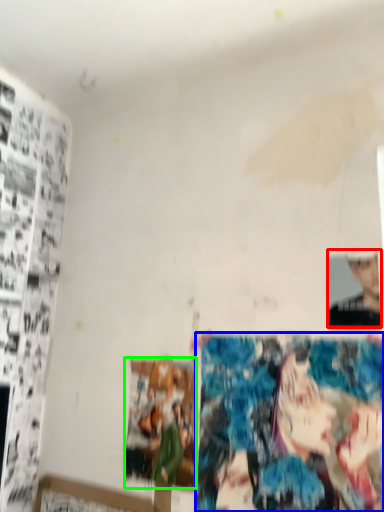
Question: Which is nearer to the person (highlighted by a red box)? reflection (highlighted by a blue box) or print (highlighted by a green box).

Choices:
 (A) reflection
 (B) print

Answer: (A)